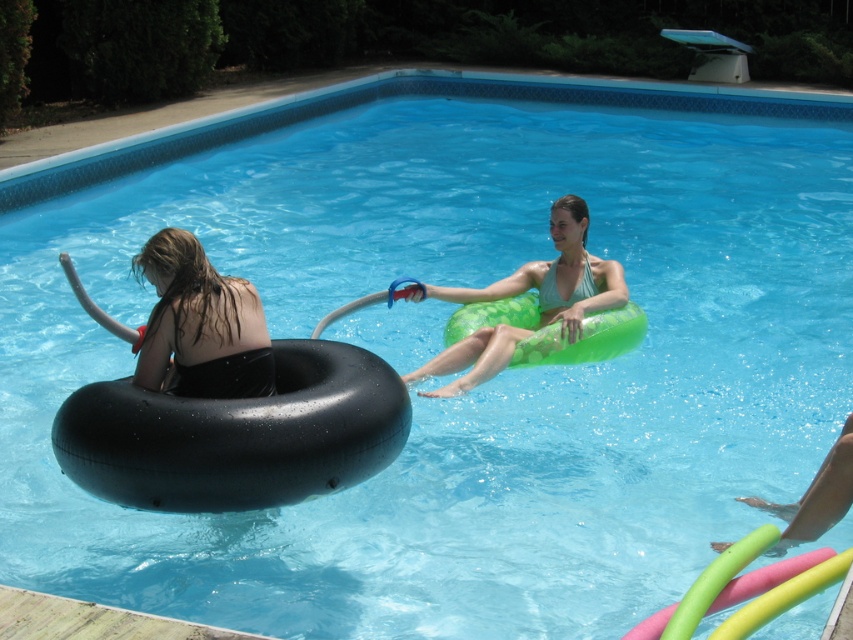
Does black rubber tube at left have a greater height compared to green rubber ring at center?

Incorrect, black rubber tube at left's height is not larger of green rubber ring at center's.

Is black rubber tube at left positioned behind green rubber ring at center?

No, it is in front of green rubber ring at center.

Who is more distant from viewer, (201, 273) or (584, 268)?

The point (584, 268) is behind.

In order to click on black rubber tube at left in this screenshot , I will do point(200,324).